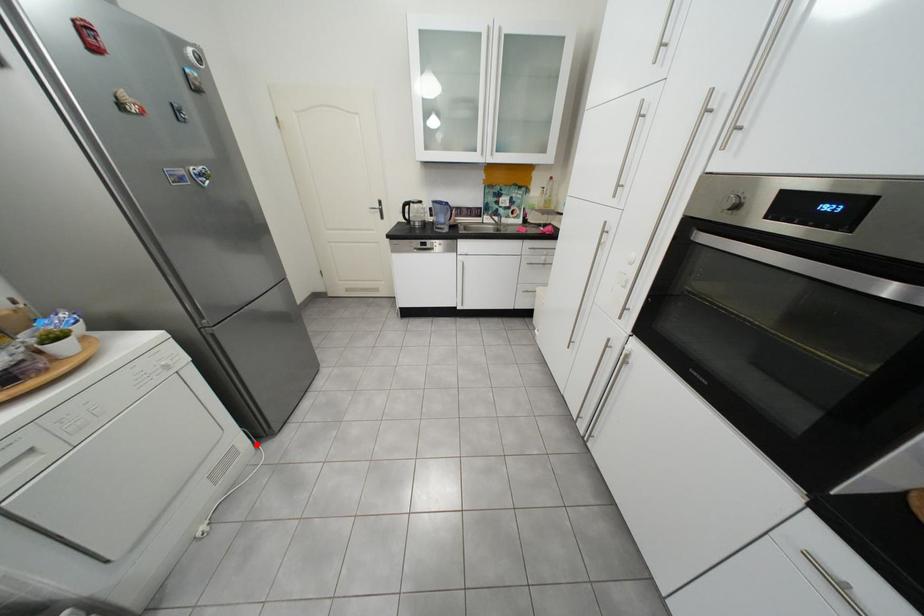
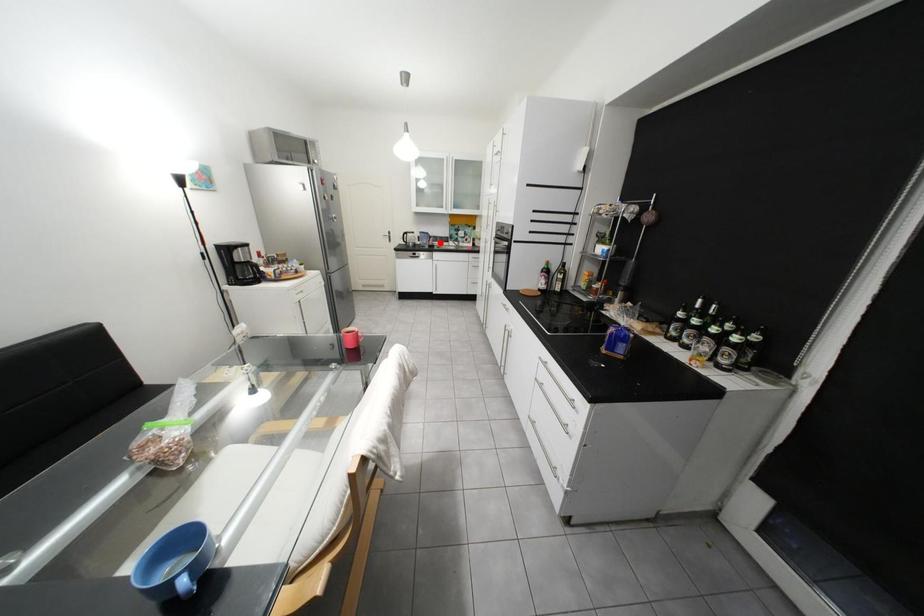
I am providing you with two images of the same scene from different viewpoints. A red point is marked on the first image and another point is marked on the second image. Is the red point in image1 aligned with the point shown in image2?

No